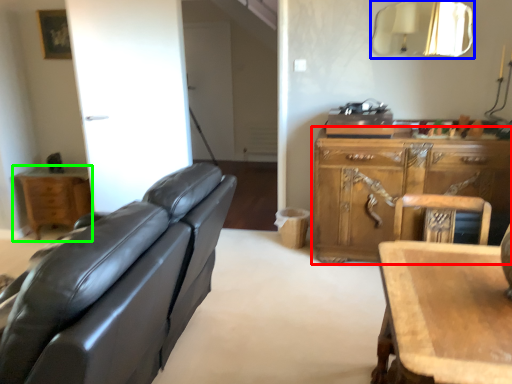
Question: Which object is the farthest from cabinetry (highlighted by a red box)? Choose among these: mirror (highlighted by a blue box) or nightstand (highlighted by a green box).

Choices:
 (A) mirror
 (B) nightstand

Answer: (B)